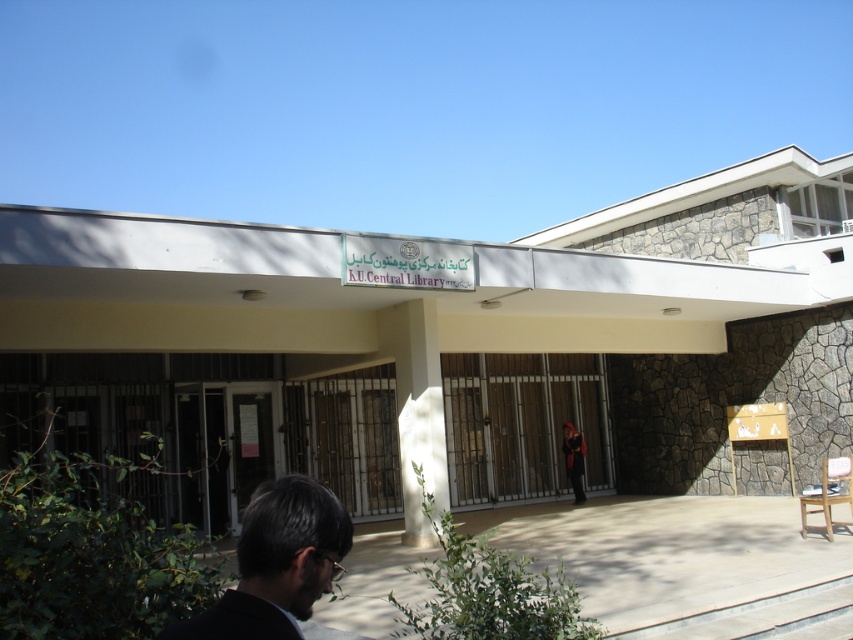
You are standing at the entrance of K.U. Central Library and want to take a photo of the dark brown hair at lower left without including the metallic gate at center in the frame. Is it possible to do so by moving forward or backward?

The metallic gate at center is further to the viewer than dark brown hair at lower left. Moving forward would bring the metallic gate at center closer and potentially block the view of the dark brown hair at lower left, while moving backward might allow you to position yourself so that the metallic gate at center is out of the frame. Therefore, moving backward could help avoid including the metallic gate at center in the photo.

You are standing at the entrance of K.U. Central Library and want to locate the person with dark brown hair at lower left and the dark red fabric at center. How far apart are these two objects from each other?

The dark brown hair at lower left and dark red fabric at center are 13.44 meters apart.